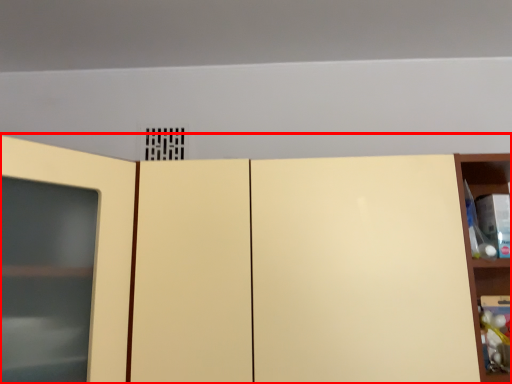
Question: From the image's perspective, what is the correct spatial positioning of cupboard (annotated by the red box) in reference to shelf?

Choices:
 (A) above
 (B) below

Answer: (A)